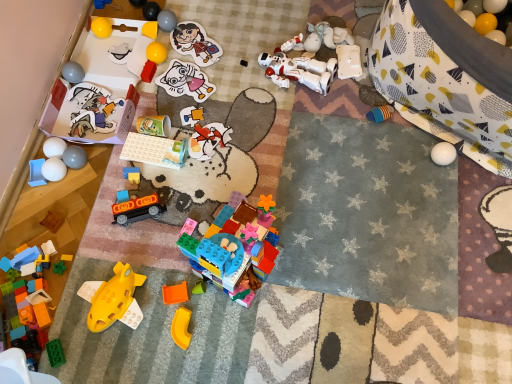
You are a GUI agent. You are given a task and a screenshot of the screen. Output one action in this format:
    pyautogui.click(x=<x>, y=<y>)
    Task: Click on the vacant area that lies between white plastic remote control at upper center, the 24th toy when ordered from left to right, and yellow matte plastic arch at center, which is the 5th toy in right-to-left order
    The image size is (512, 384).
    Given the screenshot: What is the action you would take?
    pyautogui.click(x=290, y=160)